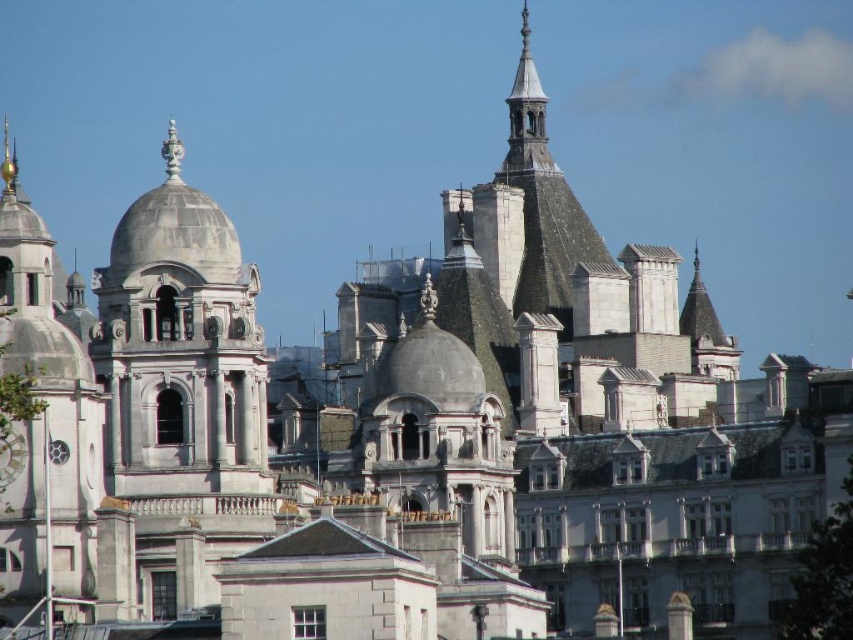
Question: Which of the following is the farthest from the observer?

Choices:
 (A) white marble clock at center
 (B) white stone clock tower at left

Answer: (A)

Question: Which point appears closest to the camera in this image?

Choices:
 (A) (16, 435)
 (B) (16, 584)

Answer: (B)

Question: Does white stone clock tower at left have a greater width compared to white marble clock at center?

Choices:
 (A) no
 (B) yes

Answer: (B)

Question: Does white stone clock tower at left appear on the left side of white marble clock at center?

Choices:
 (A) yes
 (B) no

Answer: (A)

Question: Which object is closer to the camera taking this photo?

Choices:
 (A) white stone clock tower at left
 (B) white marble clock at center

Answer: (A)

Question: Is white stone clock tower at left wider than white marble clock at center?

Choices:
 (A) yes
 (B) no

Answer: (A)